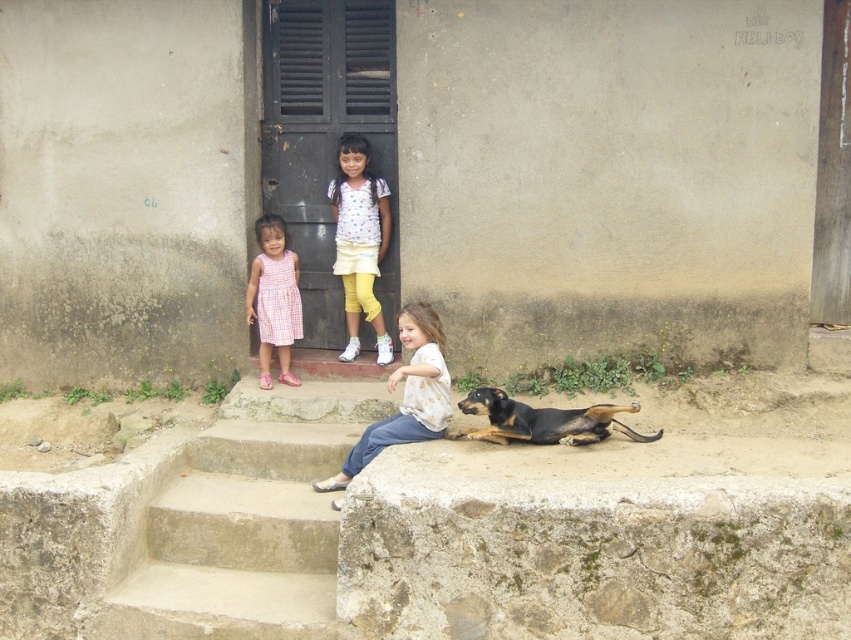
Question: Where is concrete stairs at lower center located in relation to white dotted shirt at upper center in the image?

Choices:
 (A) above
 (B) below

Answer: (B)

Question: Which object appears closest to the camera in this image?

Choices:
 (A) white cotton shirt at center
 (B) concrete stairs at lower center
 (C) black and tan fur dog at lower right

Answer: (B)

Question: Based on their relative distances, which object is nearer to the black and tan fur dog at lower right?

Choices:
 (A) concrete stairs at lower center
 (B) pink checkered dress at left

Answer: (A)

Question: Can you confirm if concrete stairs at lower center is smaller than white cotton shirt at center?

Choices:
 (A) no
 (B) yes

Answer: (A)

Question: Which of the following is the closest to the observer?

Choices:
 (A) white dotted shirt at upper center
 (B) concrete stairs at lower center

Answer: (B)

Question: Does white dotted shirt at upper center appear over white cotton shirt at center?

Choices:
 (A) no
 (B) yes

Answer: (B)